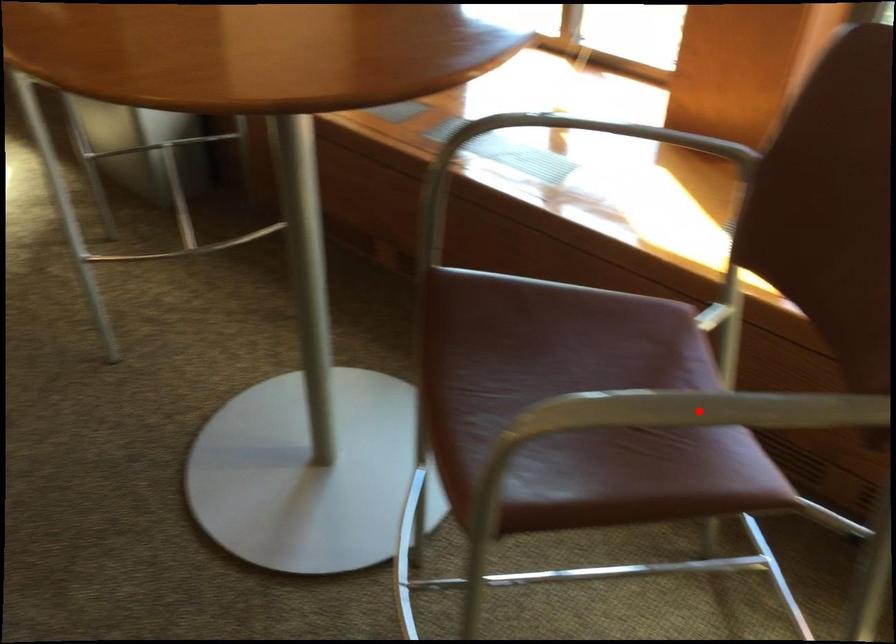
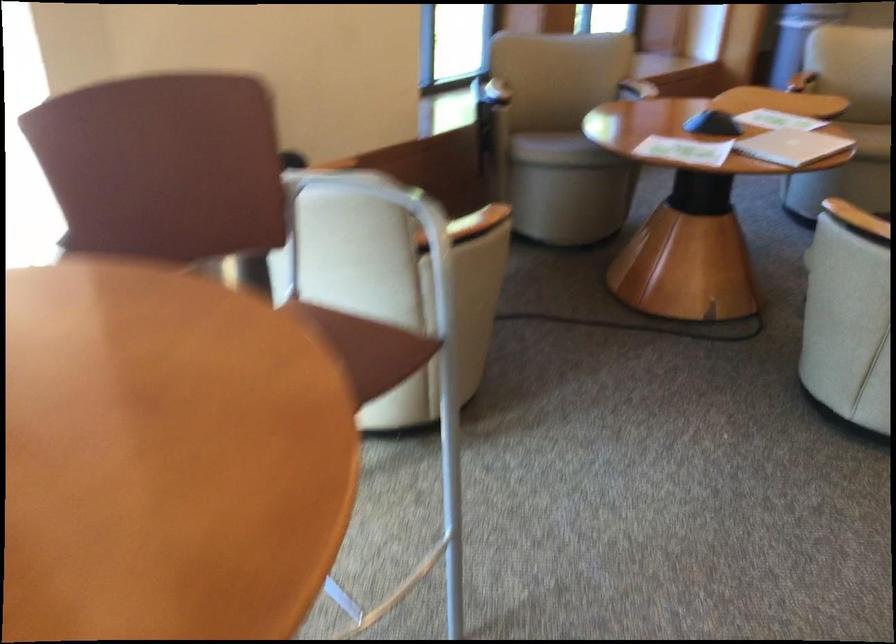
Question: I am providing you with two images of the same scene from different viewpoints. A red point is marked on the first image. At the location where the point appears in image 1, is it still visible in image 2?

Choices:
 (A) Yes
 (B) No

Answer: (B)